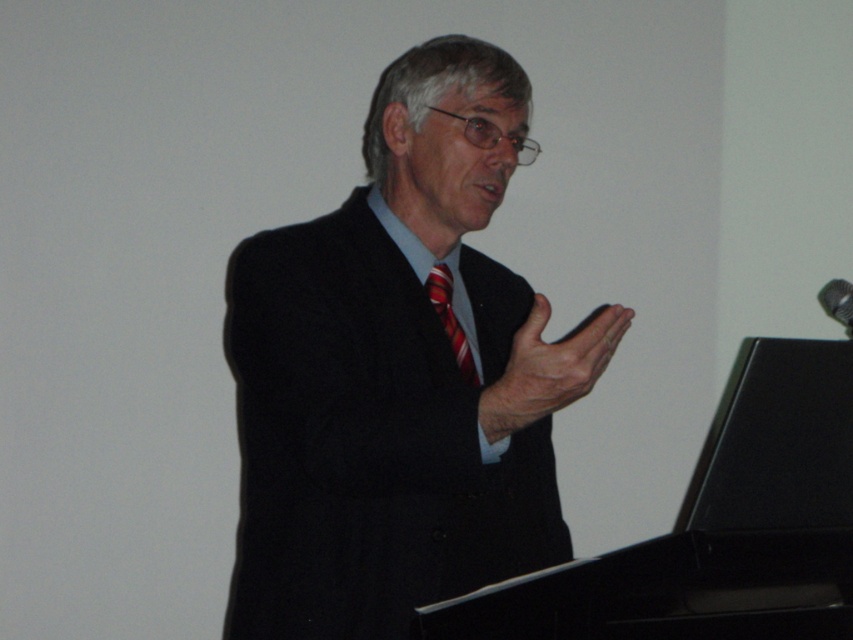
Is point (270, 604) positioned behind point (830, 314)?

No, it is in front of (830, 314).

Does point (398, 228) come closer to viewer compared to point (837, 305)?

Yes, point (398, 228) is closer to viewer.

Image resolution: width=853 pixels, height=640 pixels. Find the location of `black matte suit at center`. black matte suit at center is located at coordinates (399, 372).

The height and width of the screenshot is (640, 853). In order to click on striped silk tie at center in this screenshot , I will do coord(450,320).

Which of these two, striped silk tie at center or metallic silver microphone at upper right, stands shorter?

With less height is metallic silver microphone at upper right.

Is point (462, 352) more distant than point (844, 298)?

No, (462, 352) is in front of (844, 298).

You are a GUI agent. You are given a task and a screenshot of the screen. Output one action in this format:
    pyautogui.click(x=<x>, y=<y>)
    Task: Click on the striped silk tie at center
    The height and width of the screenshot is (640, 853).
    Given the screenshot: What is the action you would take?
    coord(450,320)

Does black matte suit at center appear over striped silk tie at center?

No, black matte suit at center is not above striped silk tie at center.

Can you confirm if black matte suit at center is positioned to the right of striped silk tie at center?

Yes, black matte suit at center is to the right of striped silk tie at center.

Is point (444, 332) closer to viewer compared to point (454, 356)?

No, it is behind (454, 356).

Where is `black matte suit at center`? black matte suit at center is located at coordinates (399, 372).